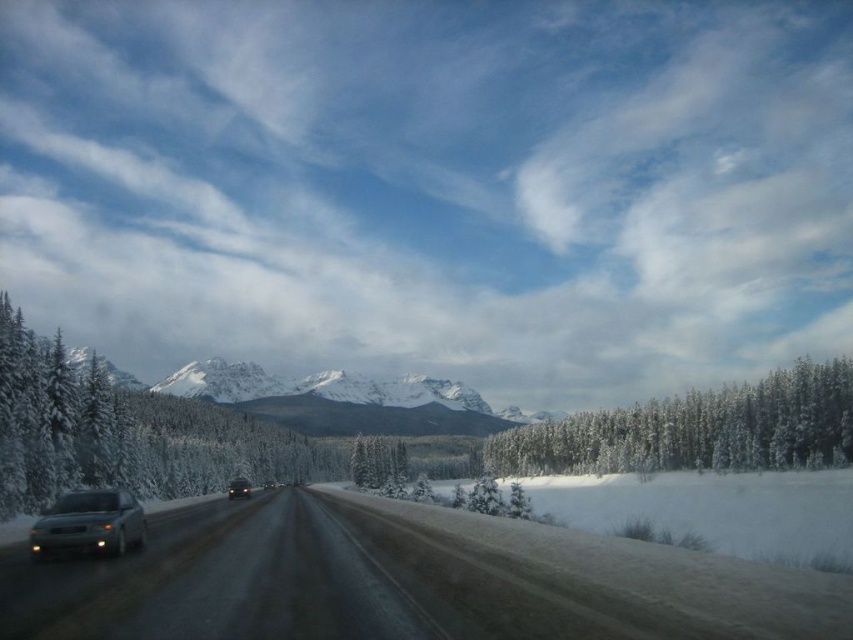
Between point (9, 323) and point (248, 492), which one is positioned behind?

The point (248, 492) is more distant.

Between snow-covered evergreen at left and matte silver sedan at center, which one is positioned higher?

Positioned higher is snow-covered evergreen at left.

Locate an element on the screen. The image size is (853, 640). snow-covered evergreen at left is located at coordinates (125, 433).

Between satin silver sedan at left and white snow-covered tree at center, which one appears on the right side from the viewer's perspective?

white snow-covered tree at center is more to the right.

Can you confirm if satin silver sedan at left is positioned to the left of white snow-covered tree at center?

Indeed, satin silver sedan at left is positioned on the left side of white snow-covered tree at center.

Who is more forward, (70, 497) or (405, 451)?

Answer: Point (70, 497) is in front.

I want to click on satin silver sedan at left, so click(90, 524).

Between point (509, 525) and point (119, 515), which one is positioned behind?

Point (509, 525)

Does slick asphalt road at center appear on the left side of satin silver sedan at left?

No, slick asphalt road at center is not to the left of satin silver sedan at left.

Does point (74, 632) come in front of point (143, 522)?

That is True.

Identify the location of slick asphalt road at center. (404, 580).